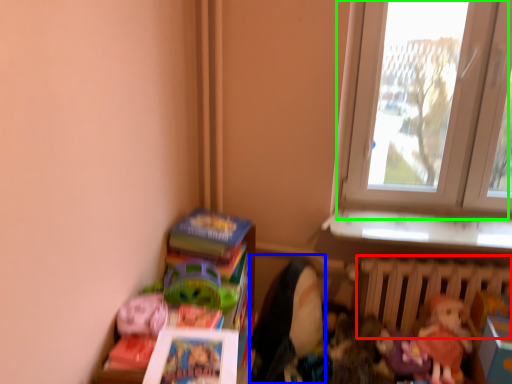
Question: Estimate the real-world distances between objects in this image. Which object is farther from radiator (highlighted by a red box), doll (highlighted by a blue box) or window (highlighted by a green box)?

Choices:
 (A) doll
 (B) window

Answer: (B)